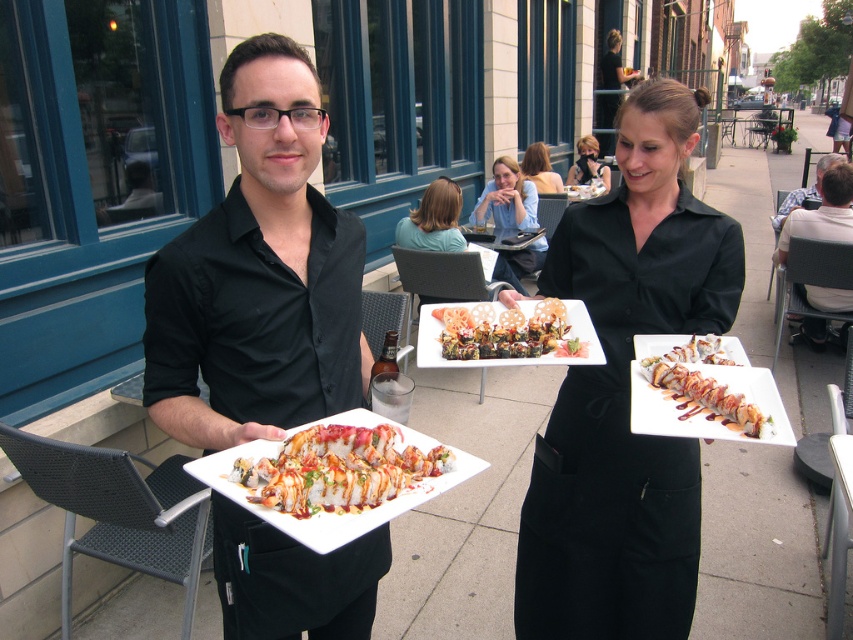
You are a customer at the restaurant and you want to know if the black matte uniform at center is taller than the smokey brown glazed sushi at center. Can you confirm this?

The black matte uniform at center is taller than the smokey brown glazed sushi at center according to the description provided.

You are a customer sitting at the table and see both the slightly glossy wooden skewers at center and the matte black dress at upper center. Which object is nearer to you?

The slightly glossy wooden skewers at center are closer to you than the matte black dress at upper center.

You are a customer at the restaurant and want to place your phone between the black matte uniform at center and the smokey brown glazed sushi at center on the table. Can you fit your phone there?

The black matte uniform at center is wider than the smokey brown glazed sushi at center, so there might not be enough space to fit your phone between them unless the phone is very small.